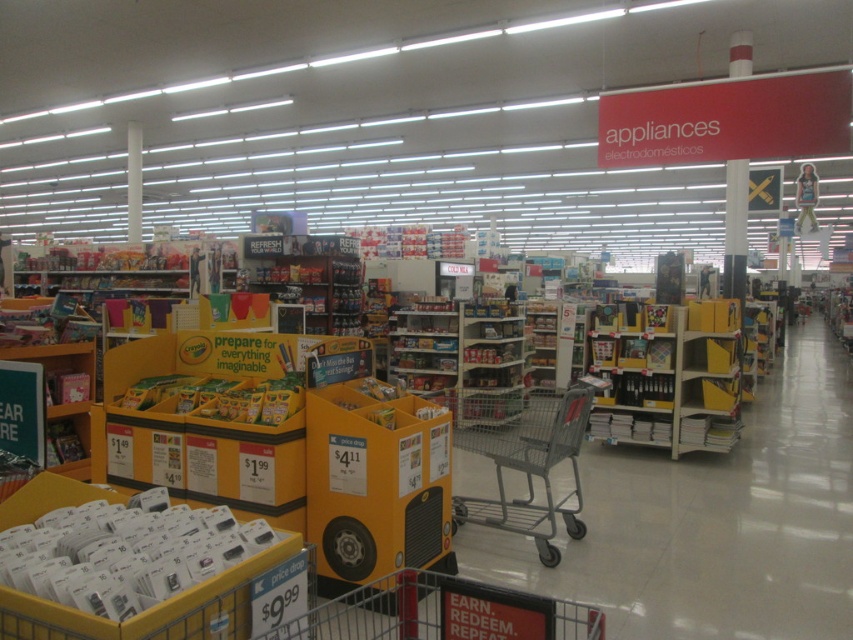
Does gray metal shopping cart at center appear under yellow plastic shelves at center?

Correct, gray metal shopping cart at center is located below yellow plastic shelves at center.

Is point (558, 442) positioned in front of point (514, 396)?

That is True.

This screenshot has width=853, height=640. What are the coordinates of `gray metal shopping cart at center` in the screenshot? It's located at (521, 456).